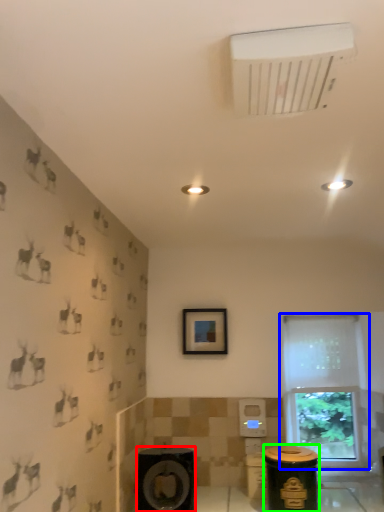
Question: Which is nearer to the speaker (highlighted by a red box)? window (highlighted by a blue box) or garbage (highlighted by a green box).

Choices:
 (A) window
 (B) garbage

Answer: (B)